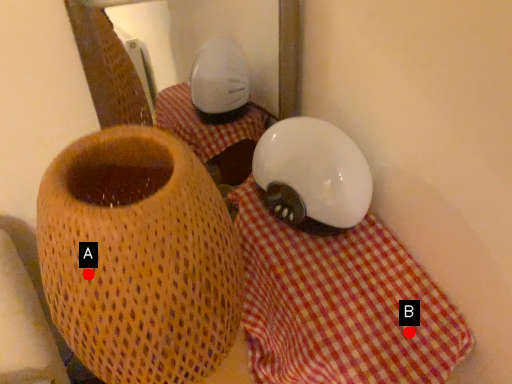
Question: Two points are circled on the image, labeled by A and B beside each circle. Which point is closer to the camera taking this photo?

Choices:
 (A) A is closer
 (B) B is closer

Answer: (A)